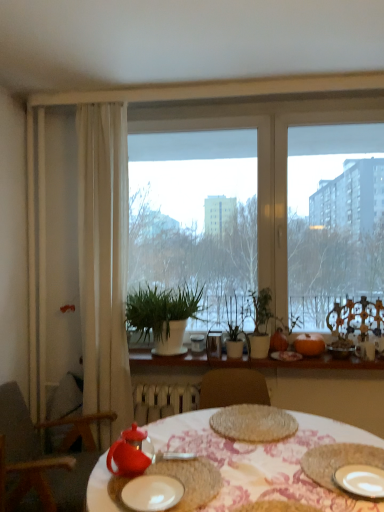
Identify the location of free spot to the left of rustic woven placemat at lower right. (262, 473).